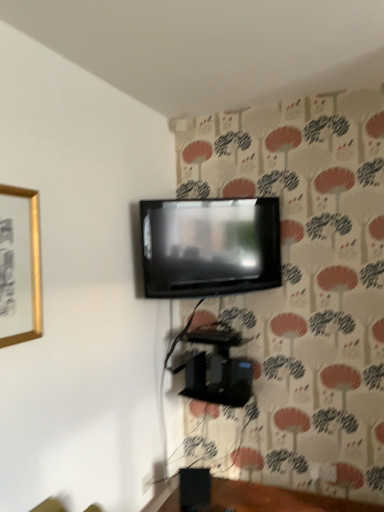
Question: Would you say gold metallic picture frame at upper left is part of matte black tv at upper center's contents?

Choices:
 (A) yes
 (B) no

Answer: (B)

Question: Is the position of matte black tv at upper center less distant than that of gold metallic picture frame at upper left?

Choices:
 (A) yes
 (B) no

Answer: (B)

Question: Considering the relative positions of matte black tv at upper center and gold metallic picture frame at upper left in the image provided, is matte black tv at upper center behind gold metallic picture frame at upper left?

Choices:
 (A) yes
 (B) no

Answer: (A)

Question: From a real-world perspective, is matte black tv at upper center on gold metallic picture frame at upper left?

Choices:
 (A) yes
 (B) no

Answer: (A)

Question: Does matte black tv at upper center have a lesser height compared to gold metallic picture frame at upper left?

Choices:
 (A) yes
 (B) no

Answer: (A)

Question: Is gold metallic picture frame at upper left bigger or smaller than black matte speaker at lower center?

Choices:
 (A) big
 (B) small

Answer: (A)

Question: In the image, is gold metallic picture frame at upper left on the left side or the right side of black matte speaker at lower center?

Choices:
 (A) right
 (B) left

Answer: (B)

Question: Do you think gold metallic picture frame at upper left is within black matte speaker at lower center, or outside of it?

Choices:
 (A) outside
 (B) inside

Answer: (A)

Question: Does point (39, 272) appear closer or farther from the camera than point (195, 505)?

Choices:
 (A) closer
 (B) farther

Answer: (A)

Question: Looking at their shapes, would you say matte black tv at upper center is wider or thinner than black glossy speaker at lower center?

Choices:
 (A) wide
 (B) thin

Answer: (B)

Question: Considering the positions of matte black tv at upper center and black glossy speaker at lower center in the image, is matte black tv at upper center bigger or smaller than black glossy speaker at lower center?

Choices:
 (A) small
 (B) big

Answer: (A)

Question: Considering their positions, is matte black tv at upper center located in front of or behind black glossy speaker at lower center?

Choices:
 (A) front
 (B) behind

Answer: (B)

Question: Is point (145, 219) positioned closer to the camera than point (340, 507)?

Choices:
 (A) farther
 (B) closer

Answer: (A)

Question: From a real-world perspective, relative to gold metallic picture frame at upper left, is black matte speaker at lower center vertically above or below?

Choices:
 (A) above
 (B) below

Answer: (B)

Question: Based on their sizes in the image, would you say black matte speaker at lower center is bigger or smaller than gold metallic picture frame at upper left?

Choices:
 (A) small
 (B) big

Answer: (A)